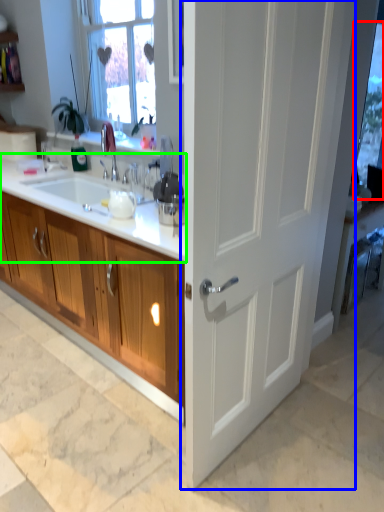
Question: Considering the real-world distances, which object is farthest from window screen (highlighted by a red box)? door (highlighted by a blue box) or countertop (highlighted by a green box)?

Choices:
 (A) door
 (B) countertop

Answer: (B)